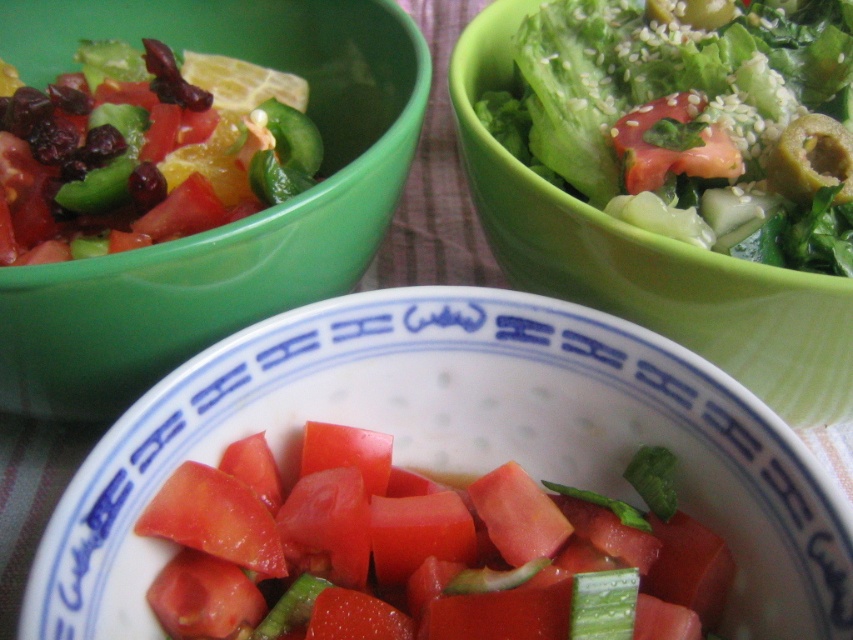
Image resolution: width=853 pixels, height=640 pixels. In order to click on green sesame seed salad at upper right in this screenshot , I will do `click(693, 120)`.

Can you confirm if green sesame seed salad at upper right is positioned to the right of white glossy bowl at center?

Indeed, green sesame seed salad at upper right is positioned on the right side of white glossy bowl at center.

Find the location of a particular element. green sesame seed salad at upper right is located at coordinates pyautogui.click(x=693, y=120).

Is point (352, 588) farther from viewer compared to point (395, 22)?

No, (352, 588) is closer to viewer.

Is point (556, 602) more distant than point (316, 113)?

That is False.

At what (x,y) coordinates should I click in order to perform the action: click on bright red tomato at center. Please return your answer as a coordinate pair (x, y). This screenshot has width=853, height=640. Looking at the image, I should click on (416, 552).

Which is behind, point (717, 163) or point (302, 161)?

The point (302, 161) is more distant.

Between point (619, 164) and point (100, 86), which one is positioned in front?

Point (619, 164) is more forward.

Is point (622, 148) in front of point (170, 216)?

No, it is not.

I want to click on green sesame seed salad at upper right, so click(x=693, y=120).